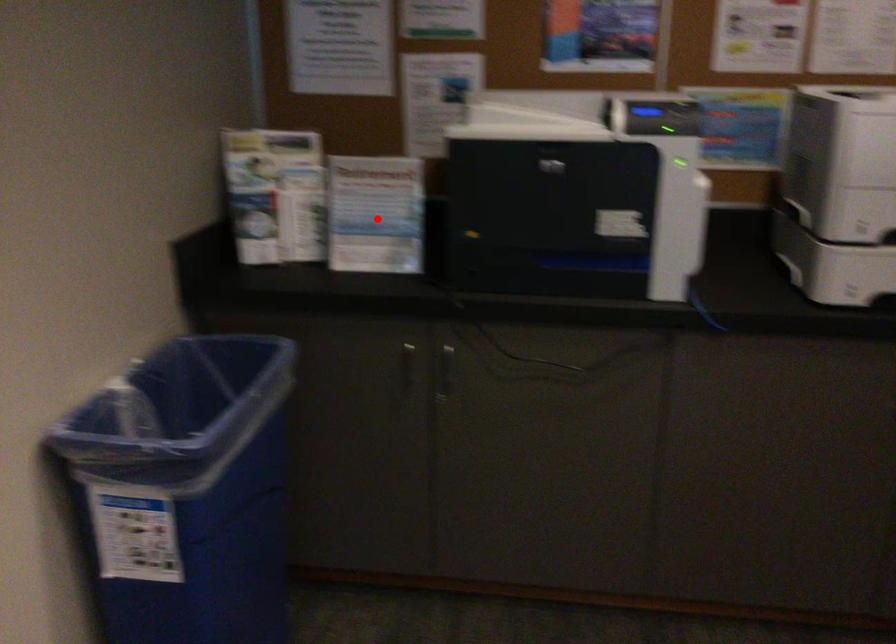
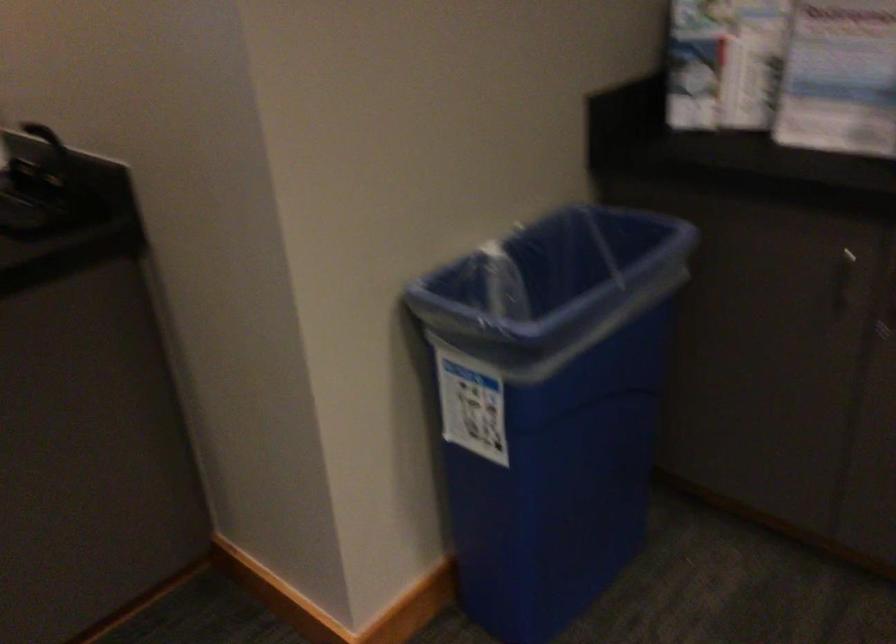
In the second image, find the point that corresponds to the highlighted location in the first image.

(840, 79)